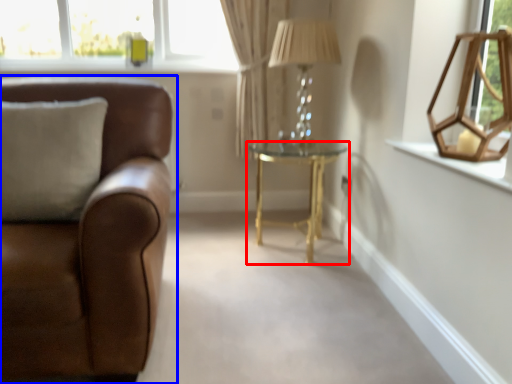
Question: Which point is closer to the camera, table (highlighted by a red box) or studio couch (highlighted by a blue box)?

Choices:
 (A) table
 (B) studio couch

Answer: (B)